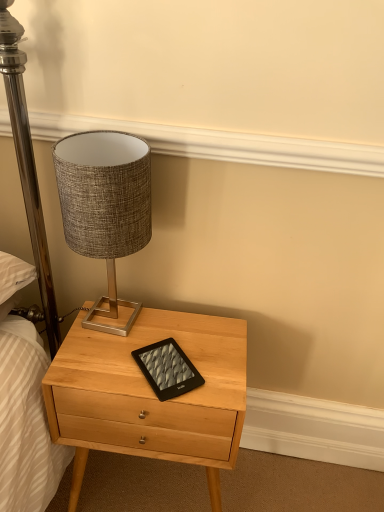
Image resolution: width=384 pixels, height=512 pixels. I want to click on free space above light wood nightstand at center (from a real-world perspective), so click(x=146, y=346).